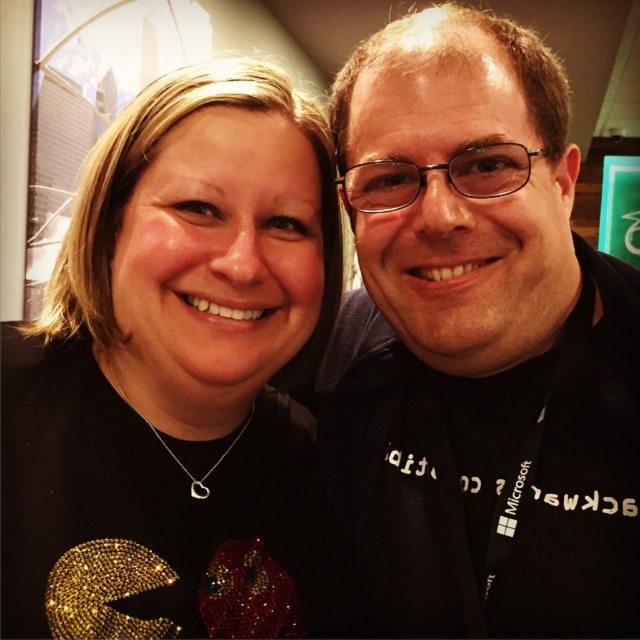
Does point (413, 291) lie in front of point (179, 179)?

No.

Which of these two, black matte shirt at center or black matte pac-man at center, stands taller?

With more height is black matte shirt at center.

At what (x,y) coordinates should I click in order to perform the action: click on black matte shirt at center. Please return your answer as a coordinate pair (x, y). The image size is (640, 640). Looking at the image, I should click on pyautogui.click(x=481, y=346).